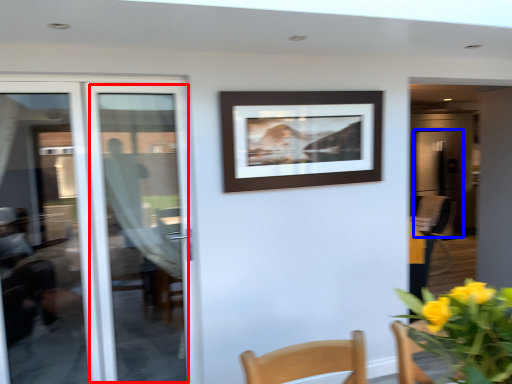
Question: Which point is closer to the camera, door (highlighted by a red box) or screen door (highlighted by a blue box)?

Choices:
 (A) door
 (B) screen door

Answer: (A)